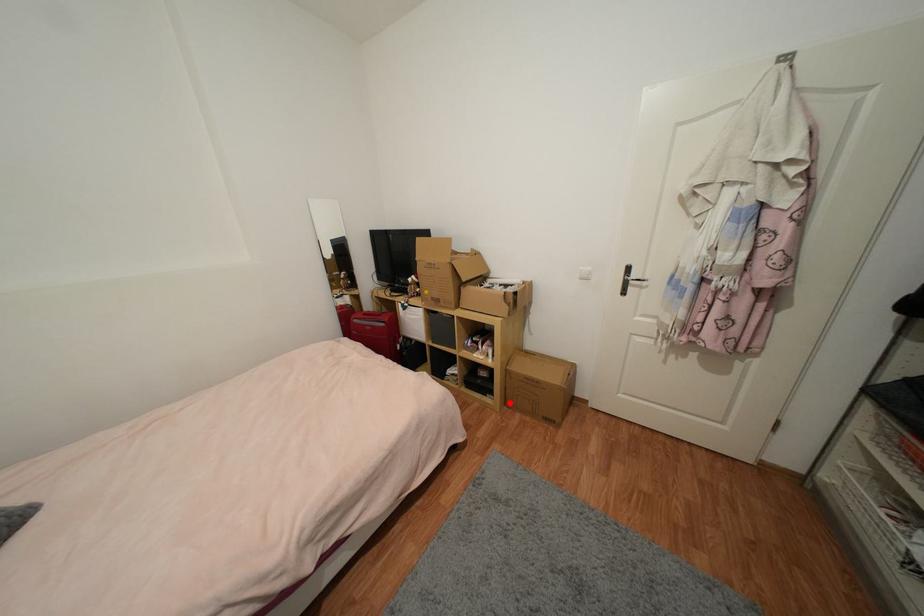
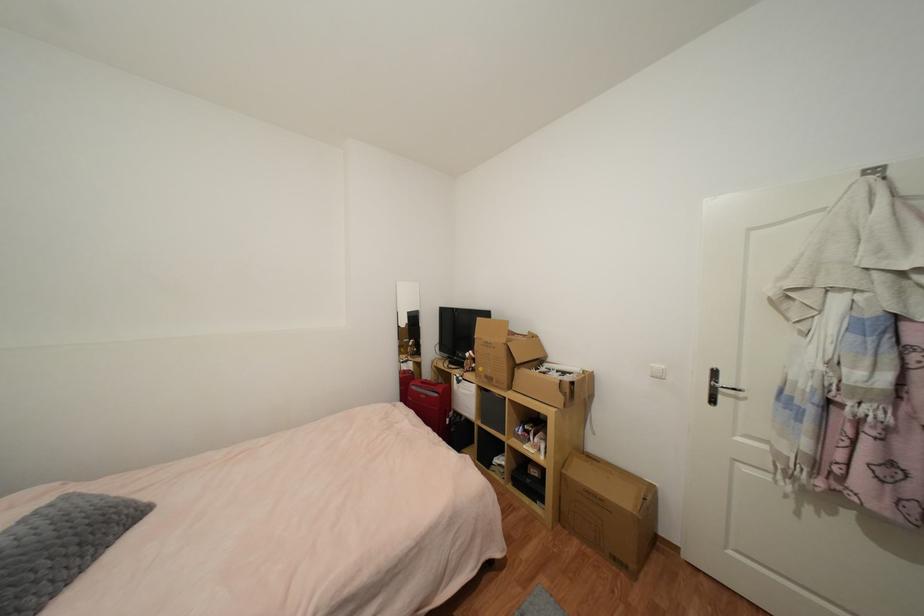
Locate, in the second image, the point that corresponds to the highlighted location in the first image.

(564, 517)